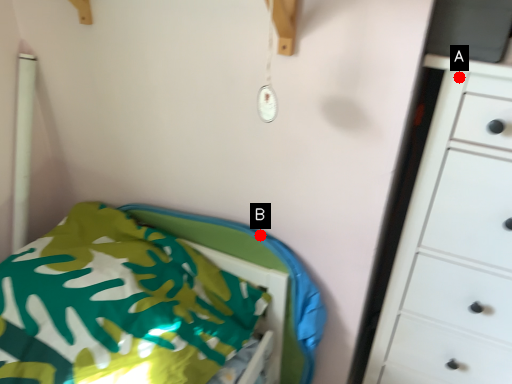
Question: Two points are circled on the image, labeled by A and B beside each circle. Among these points, which one is nearest to the camera?

Choices:
 (A) A is closer
 (B) B is closer

Answer: (A)